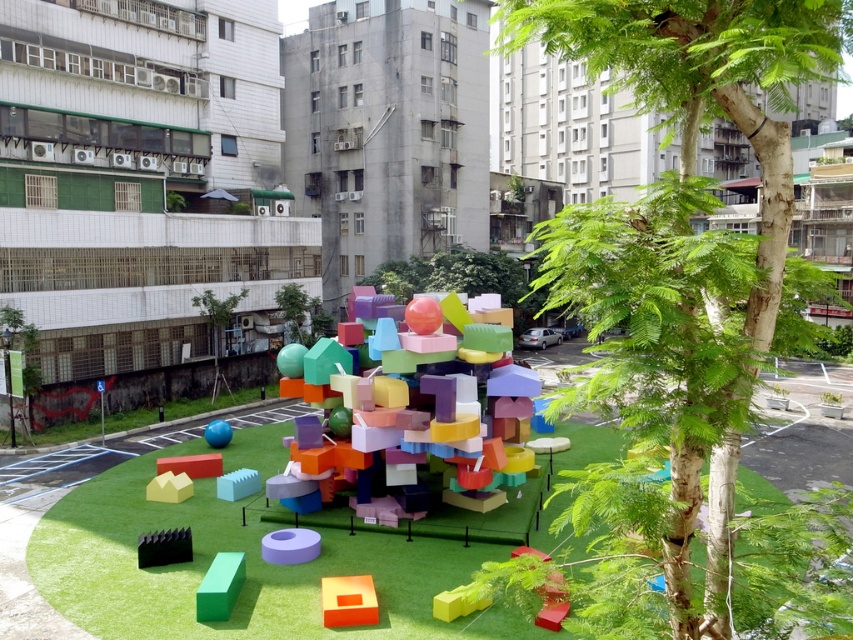
Does green leafy tree at center appear on the left side of green matte grass at center?

Yes, green leafy tree at center is to the left of green matte grass at center.

Is green leafy tree at center positioned behind green matte grass at center?

No, green leafy tree at center is in front of green matte grass at center.

Which is in front, point (695, 19) or point (183, 563)?

Point (695, 19) is more forward.

This screenshot has width=853, height=640. Find the location of `green leafy tree at center`. green leafy tree at center is located at coordinates (700, 204).

Is orange matte cube at lower center to the left of green matte block at lower left from the viewer's perspective?

In fact, orange matte cube at lower center is to the right of green matte block at lower left.

The height and width of the screenshot is (640, 853). What do you see at coordinates (347, 600) in the screenshot?
I see `orange matte cube at lower center` at bounding box center [347, 600].

Is point (334, 609) more distant than point (239, 561)?

No, (334, 609) is in front of (239, 561).

The image size is (853, 640). I want to click on orange matte cube at lower center, so pyautogui.click(x=347, y=600).

Which is in front, point (238, 460) or point (305, 540)?

Point (305, 540) is in front.

Consider the image. Who is more distant from viewer, [146,474] or [282,557]?

Point [146,474]

At what (x,y) coordinates should I click in order to perform the action: click on green matte grass at center. Please return your answer as a coordinate pair (x, y). The image size is (853, 640). Looking at the image, I should click on (247, 564).